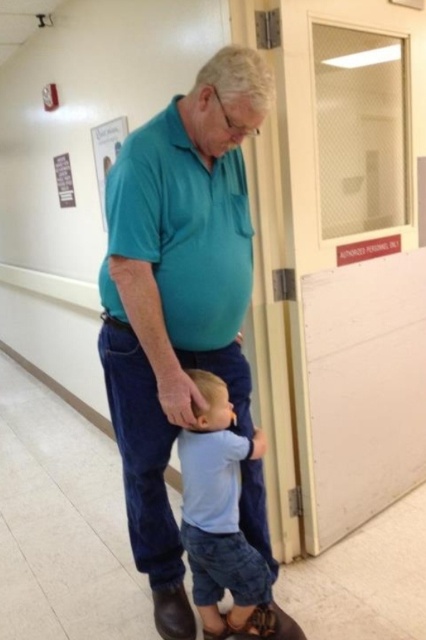
Based on the photo, between teal smooth shirt at center and light blue denim shorts at lower center, which one has less height?

Standing shorter between the two is light blue denim shorts at lower center.

Can you confirm if teal smooth shirt at center is positioned to the right of light blue denim shorts at lower center?

In fact, teal smooth shirt at center is to the left of light blue denim shorts at lower center.

Does point (146, 288) lie in front of point (236, 502)?

Yes, it is in front of point (236, 502).

What are the coordinates of `teal smooth shirt at center` in the screenshot? It's located at (178, 296).